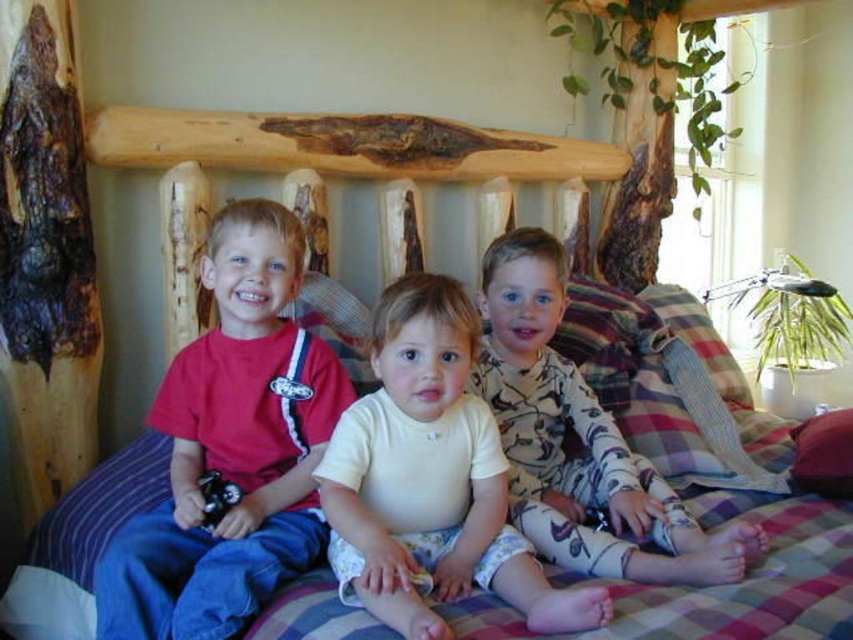
You are a photographer trying to capture a closeup of the smooth cream shirt at center and camouflage pajamas at center. Since both are at the center, which one is closer to the camera?

The smooth cream shirt at center is positioned under camouflage pajamas at center, so the camouflage pajamas at center is closer to the camera.